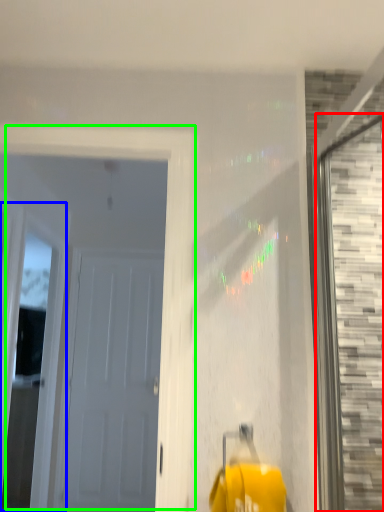
Question: Estimate the real-world distances between objects in this image. Which object is farther from window (highlighted by a red box), window (highlighted by a blue box) or door (highlighted by a green box)?

Choices:
 (A) window
 (B) door

Answer: (A)